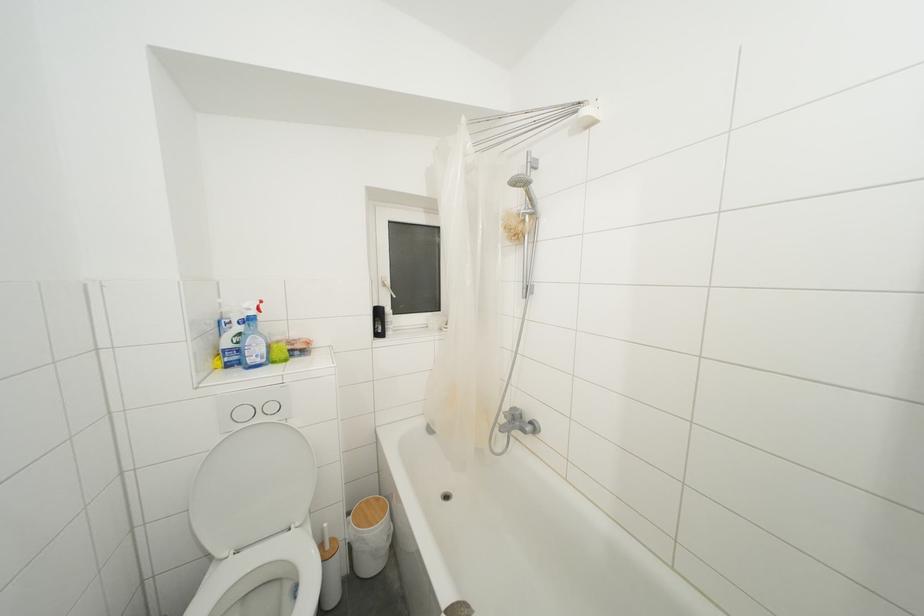
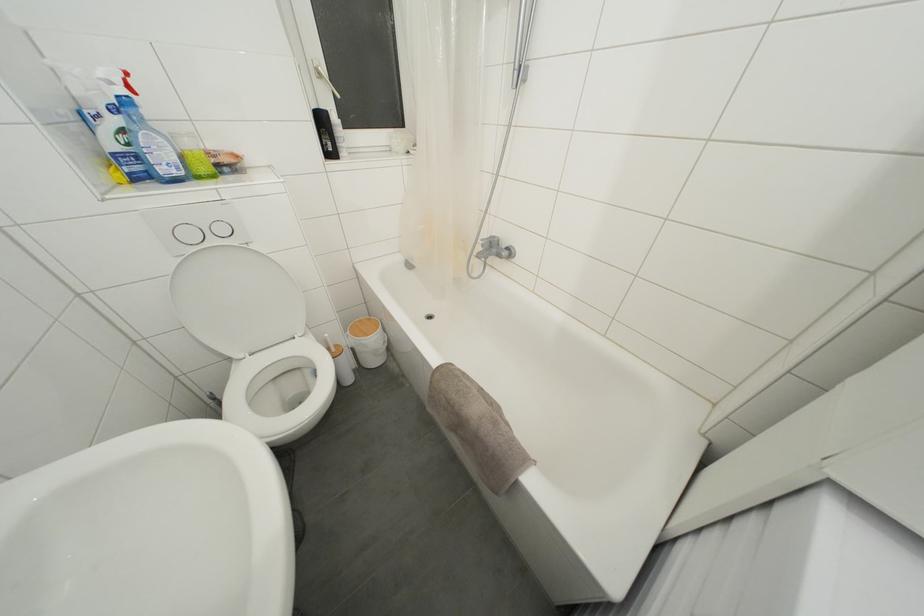
The point at (249, 418) is marked in the first image. Where is the corresponding point in the second image?

(195, 240)